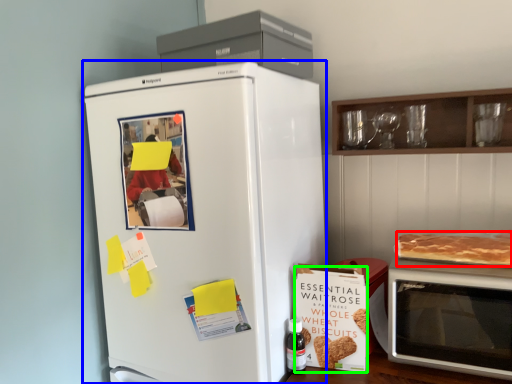
Question: Estimate the real-world distances between objects in this image. Which object is closer to pancake (highlighted by a red box), refrigerator (highlighted by a blue box) or postcard (highlighted by a green box)?

Choices:
 (A) refrigerator
 (B) postcard

Answer: (B)